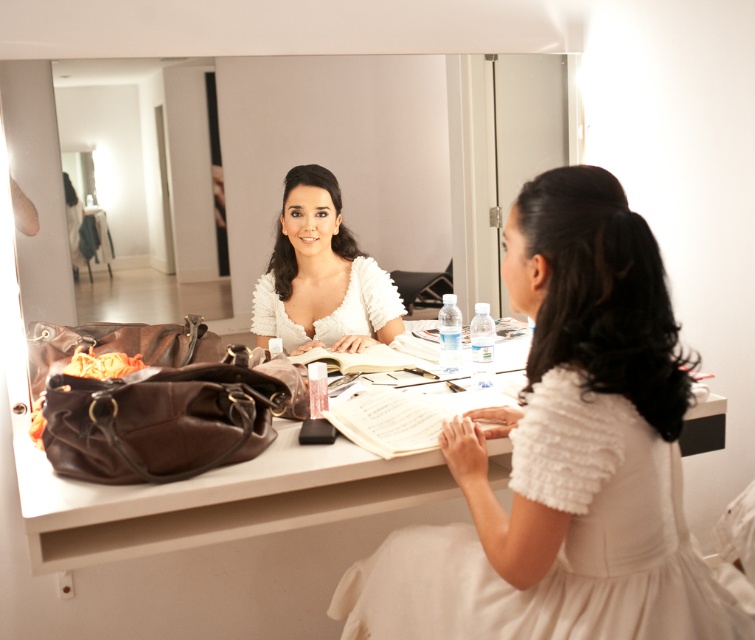
Can you confirm if white fluffy dress at center is positioned above brown leather vanity at center?

Actually, white fluffy dress at center is below brown leather vanity at center.

Based on the photo, is white fluffy dress at center positioned in front of brown leather vanity at center?

Yes.

Is point (575, 477) positioned behind point (35, 481)?

No, (575, 477) is in front of (35, 481).

Locate an element on the screen. The width and height of the screenshot is (755, 640). white fluffy dress at center is located at coordinates (556, 541).

Can you confirm if brown leather vanity at center is positioned to the left of white ruffled dress at center?

Yes, brown leather vanity at center is to the left of white ruffled dress at center.

Can you confirm if brown leather vanity at center is shorter than white ruffled dress at center?

Indeed, brown leather vanity at center has a lesser height compared to white ruffled dress at center.

The width and height of the screenshot is (755, 640). I want to click on brown leather vanity at center, so click(x=213, y=499).

Locate an element on the screen. brown leather vanity at center is located at coordinates 213,499.

Does clear glass mirror at upper center appear on the right side of white ruffled dress at center?

Correct, you'll find clear glass mirror at upper center to the right of white ruffled dress at center.

Is clear glass mirror at upper center shorter than white ruffled dress at center?

In fact, clear glass mirror at upper center may be taller than white ruffled dress at center.

Is point (492, 195) farther from viewer compared to point (307, 209)?

Yes, point (492, 195) is behind point (307, 209).

Where is `clear glass mirror at upper center`? clear glass mirror at upper center is located at coordinates (396, 154).